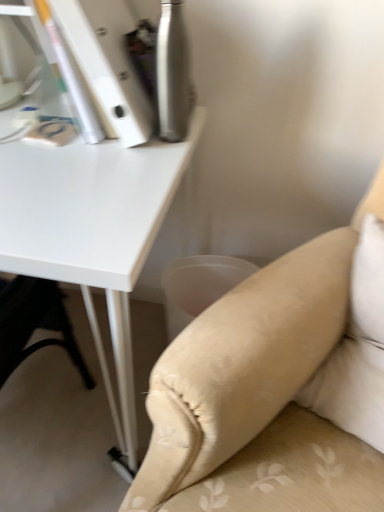
Question: Is the depth of white matte table at upper left less than that of beige fabric pillow at lower right?

Choices:
 (A) no
 (B) yes

Answer: (A)

Question: Is white matte table at upper left facing towards beige fabric pillow at lower right?

Choices:
 (A) no
 (B) yes

Answer: (A)

Question: Considering the relative sizes of white matte table at upper left and beige fabric pillow at lower right in the image provided, is white matte table at upper left taller than beige fabric pillow at lower right?

Choices:
 (A) yes
 (B) no

Answer: (A)

Question: Is the depth of white matte table at upper left greater than that of beige fabric pillow at lower right?

Choices:
 (A) yes
 (B) no

Answer: (A)

Question: Does white matte table at upper left have a greater width compared to beige fabric pillow at lower right?

Choices:
 (A) yes
 (B) no

Answer: (A)

Question: In terms of width, does beige fabric pillow at lower right look wider or thinner when compared to beige fabric couch at lower right?

Choices:
 (A) thin
 (B) wide

Answer: (A)

Question: Considering their positions, is beige fabric pillow at lower right located in front of or behind beige fabric couch at lower right?

Choices:
 (A) front
 (B) behind

Answer: (B)

Question: From a real-world perspective, is beige fabric pillow at lower right physically located above or below beige fabric couch at lower right?

Choices:
 (A) below
 (B) above

Answer: (B)

Question: Is beige fabric pillow at lower right taller or shorter than beige fabric couch at lower right?

Choices:
 (A) short
 (B) tall

Answer: (A)

Question: From a real-world perspective, is beige fabric couch at lower right positioned above or below beige fabric pillow at lower right?

Choices:
 (A) above
 (B) below

Answer: (B)

Question: Is beige fabric couch at lower right spatially inside beige fabric pillow at lower right, or outside of it?

Choices:
 (A) inside
 (B) outside

Answer: (B)

Question: In the image, is beige fabric couch at lower right on the left side or the right side of beige fabric pillow at lower right?

Choices:
 (A) right
 (B) left

Answer: (B)

Question: From the image's perspective, is beige fabric couch at lower right positioned above or below beige fabric pillow at lower right?

Choices:
 (A) below
 (B) above

Answer: (A)

Question: From the image's perspective, is beige fabric pillow at lower right positioned above or below white matte table at upper left?

Choices:
 (A) below
 (B) above

Answer: (A)

Question: Would you say beige fabric pillow at lower right is to the left or to the right of white matte table at upper left in the picture?

Choices:
 (A) right
 (B) left

Answer: (A)